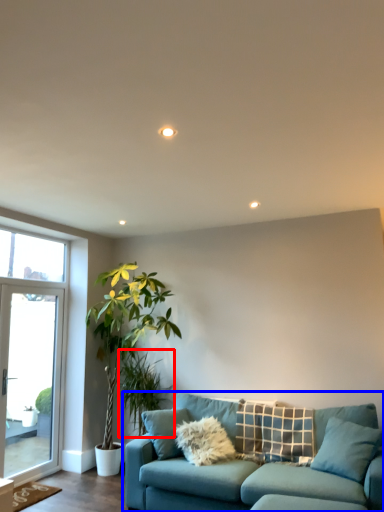
Question: Among these objects, which one is nearest to the camera, plant (highlighted by a red box) or studio couch (highlighted by a blue box)?

Choices:
 (A) plant
 (B) studio couch

Answer: (B)